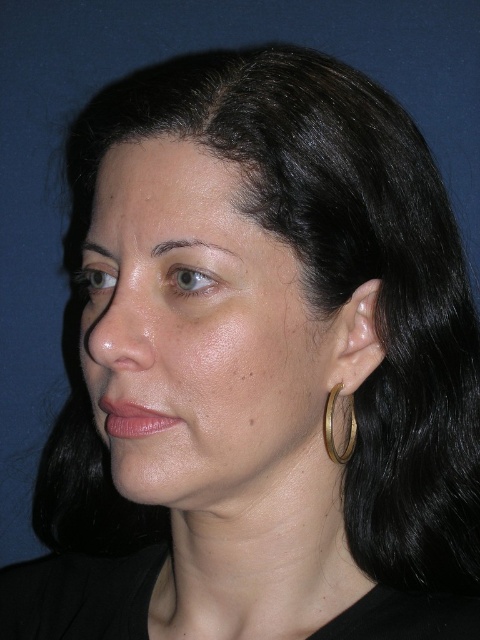
Question: Does smooth skin face at center appear on the right side of gold metallic hoop at ear?

Choices:
 (A) no
 (B) yes

Answer: (A)

Question: Which of the following is the closest to the observer?

Choices:
 (A) (325, 449)
 (B) (196, 257)

Answer: (B)

Question: Is smooth skin face at center smaller than gold metallic hoop at ear?

Choices:
 (A) yes
 (B) no

Answer: (B)

Question: Observing the image, what is the correct spatial positioning of smooth skin face at center in reference to gold metallic hoop at ear?

Choices:
 (A) left
 (B) right

Answer: (A)

Question: Which of the following is the farthest from the observer?

Choices:
 (A) (193, 310)
 (B) (325, 404)

Answer: (B)